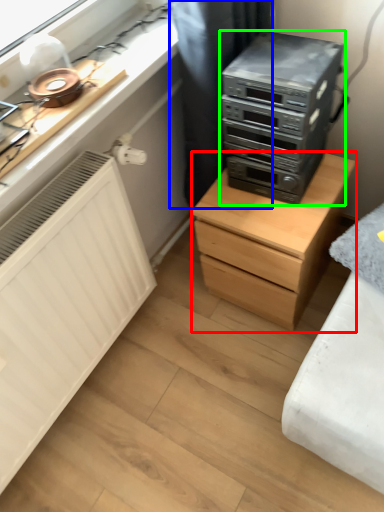
Question: Estimate the real-world distances between objects in this image. Which object is closer to chest of drawers (highlighted by a red box), curtain (highlighted by a blue box) or home appliance (highlighted by a green box)?

Choices:
 (A) curtain
 (B) home appliance

Answer: (B)